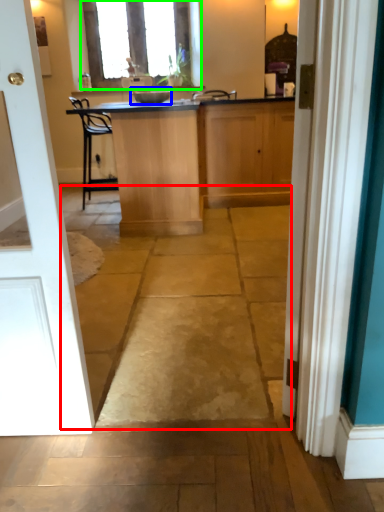
Question: Which object is the farthest from path (highlighted by a red box)? Choose among these: appliance (highlighted by a blue box) or window (highlighted by a green box).

Choices:
 (A) appliance
 (B) window

Answer: (B)